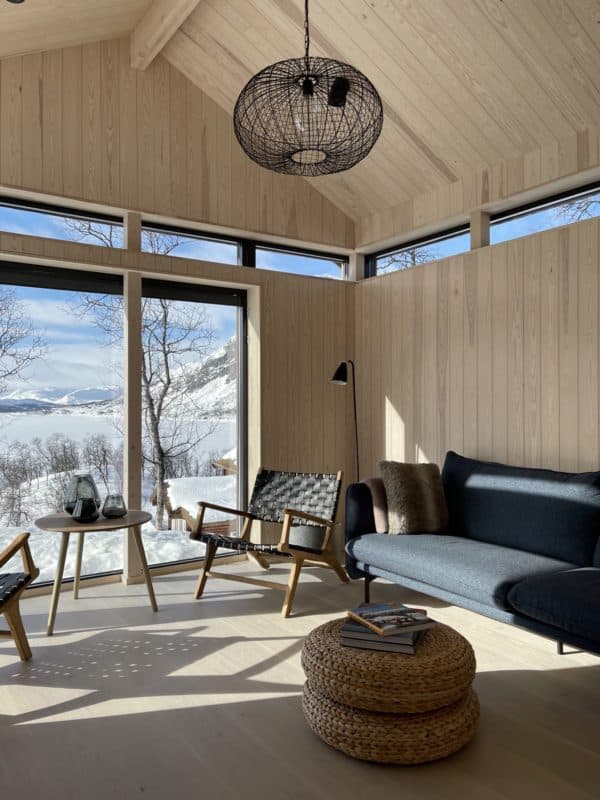
Where is `wall`? Image resolution: width=600 pixels, height=800 pixels. wall is located at coordinates (437, 417).